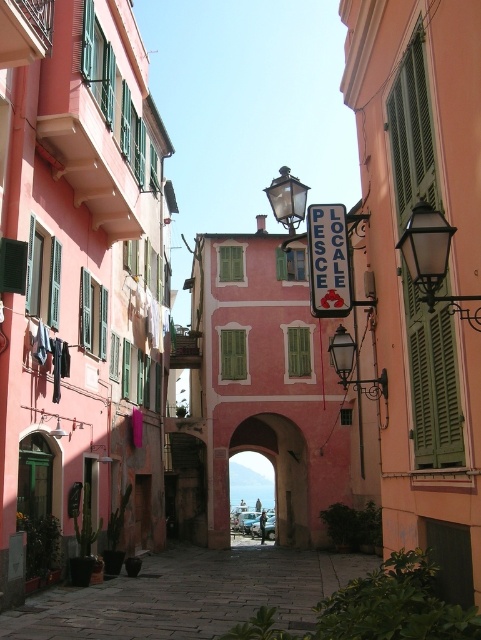
Question: Can you confirm if matte black lamp at center is thinner than green matte shutter at center?

Choices:
 (A) no
 (B) yes

Answer: (A)

Question: Among these objects, which one is nearest to the camera?

Choices:
 (A) white plastic sign at center
 (B) paved stone alley at center
 (C) matte black lamp at center
 (D) green matte shutter at center

Answer: (B)

Question: Estimate the real-world distances between objects in this image. Which object is closer to the matte black lamp at upper right?

Choices:
 (A) matte black lamp at center
 (B) paved stone alley at center

Answer: (A)

Question: Does pink stone archway at center appear over dark gray fabric at left?

Choices:
 (A) yes
 (B) no

Answer: (B)

Question: Estimate the real-world distances between objects in this image. Which object is farther from the matte black lamp at center?

Choices:
 (A) paved stone alley at center
 (B) white plastic sign at center
 (C) matte black lamp at upper right

Answer: (B)

Question: From the image, what is the correct spatial relationship of pink stone archway at center in relation to white plastic sign at center?

Choices:
 (A) below
 (B) above

Answer: (A)